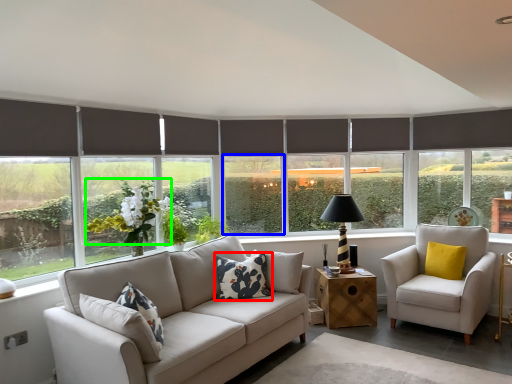
Question: Which object is the closest to the pillow (highlighted by a red box)? Choose among these: window screen (highlighted by a blue box) or flower (highlighted by a green box).

Choices:
 (A) window screen
 (B) flower

Answer: (B)